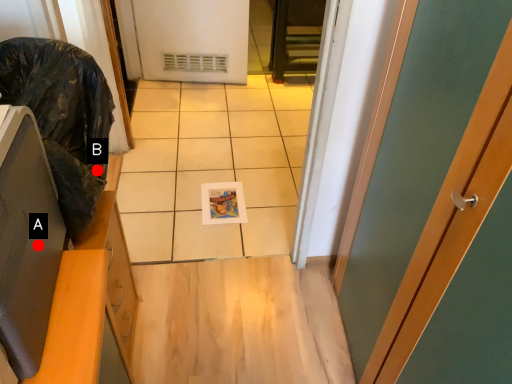
Question: Two points are circled on the image, labeled by A and B beside each circle. Among these points, which one is farthest from the camera?

Choices:
 (A) A is further
 (B) B is further

Answer: (B)